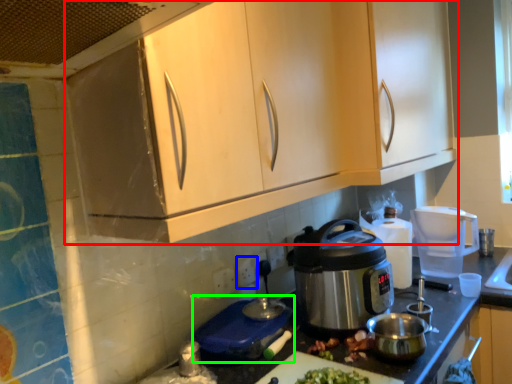
Question: Which object is positioned closest to cabinetry (highlighted by a red box)? Select from power outlet (highlighted by a blue box) and appliance (highlighted by a green box).

Choices:
 (A) power outlet
 (B) appliance

Answer: (B)